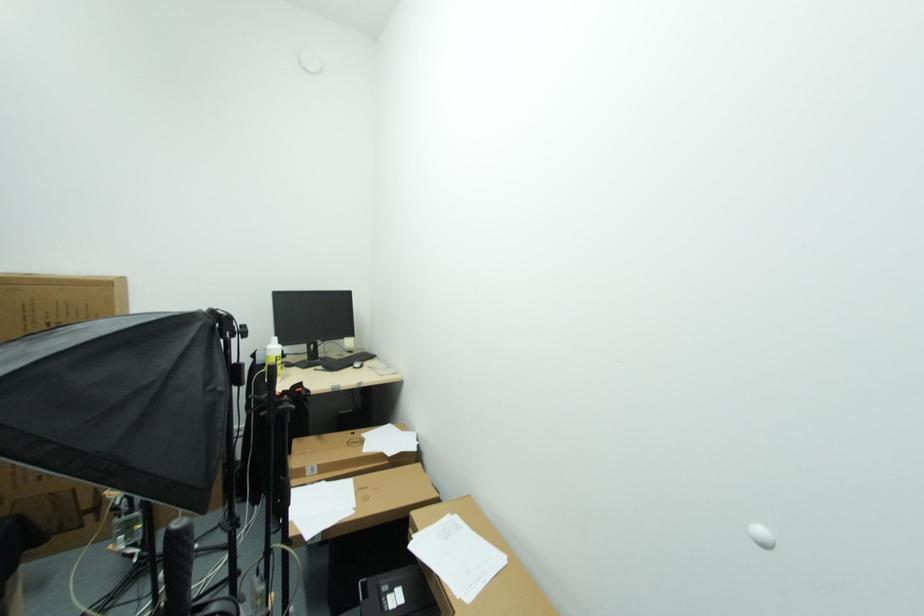
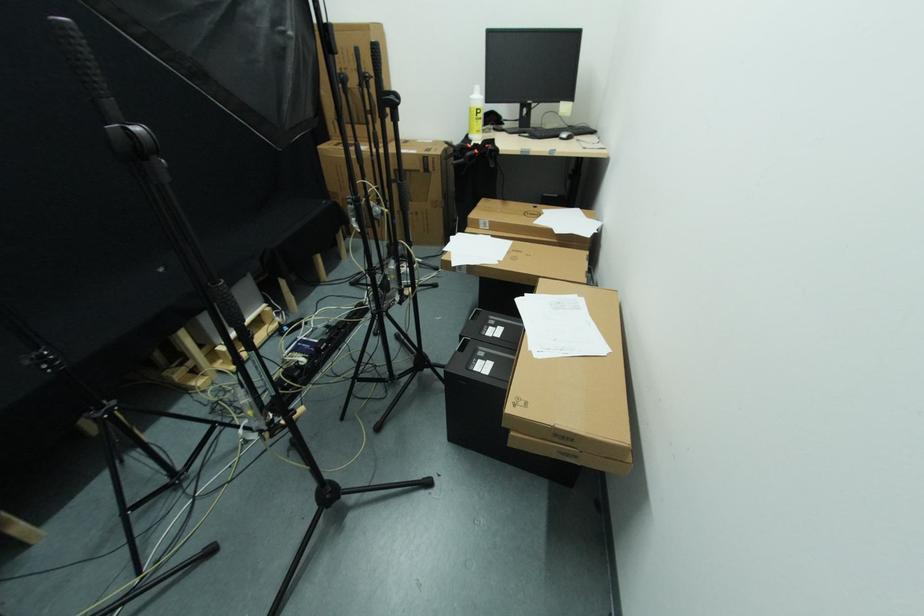
Locate, in the second image, the point that corresponds to the point at 354,368 in the first image.

(561, 139)